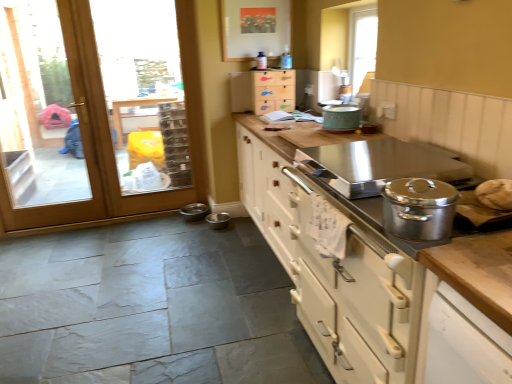
Question: Is teal matte pot at upper center bigger or smaller than metallic stainless steel bowls at lower center, the second appliance in the right-to-left sequence?

Choices:
 (A) big
 (B) small

Answer: (A)

Question: In the image, is teal matte pot at upper center positioned in front of or behind metallic stainless steel bowls at lower center, the second appliance in the right-to-left sequence?

Choices:
 (A) behind
 (B) front

Answer: (B)

Question: Which object is positioned farthest from the metallic stainless steel bowl at lower center, arranged as the 2th appliance when viewed from the left?

Choices:
 (A) wooden fish drawer at upper center, which ranks as the second cabinetry in front-to-back order
 (B) teal matte pot at upper center
 (C) white wood cabinet at center, the 1th cabinetry positioned from the bottom
 (D) metallic stainless steel bowls at lower center, the 1th appliance in the left-to-right sequence
 (E) stainless steel countertop at center

Answer: (C)

Question: Estimate the real-world distances between objects in this image. Which object is farther from the wooden fish drawer at upper center, the 1th cabinetry viewed from the top?

Choices:
 (A) stainless steel countertop at center
 (B) wooden at left
 (C) metallic stainless steel bowls at lower center, the 1th appliance in the left-to-right sequence
 (D) teal matte pot at upper center
 (E) white wood cabinet at center, the 1th cabinetry positioned from the bottom

Answer: (E)